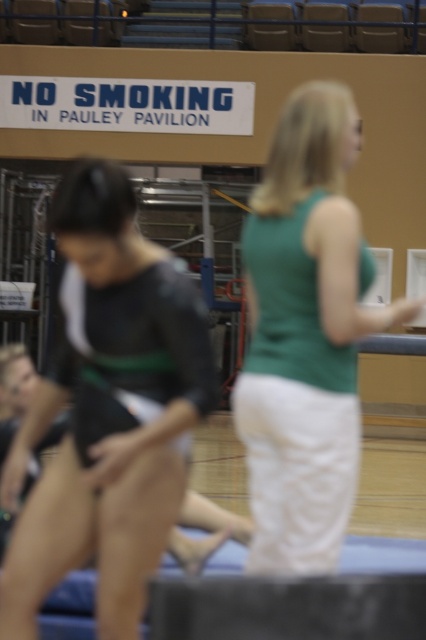
Between black leotard at left and green fabric tank top at center, which one has less height?

green fabric tank top at center is shorter.

Does black leotard at left appear over green fabric tank top at center?

Incorrect, black leotard at left is not positioned above green fabric tank top at center.

The width and height of the screenshot is (426, 640). What do you see at coordinates (109, 412) in the screenshot?
I see `black leotard at left` at bounding box center [109, 412].

At what (x,y) coordinates should I click in order to perform the action: click on black leotard at left. Please return your answer as a coordinate pair (x, y). Image resolution: width=426 pixels, height=640 pixels. Looking at the image, I should click on (109, 412).